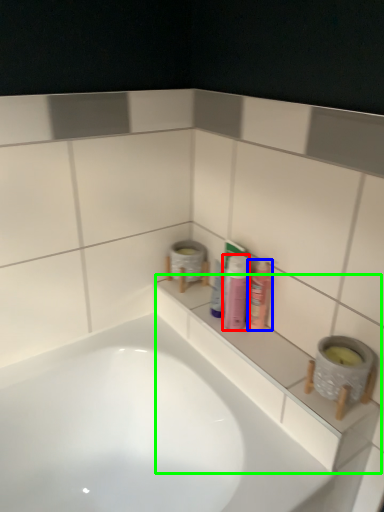
Question: Which object is the farthest from toiletry (highlighted by a red box)? Choose among these: mouthwash (highlighted by a blue box) or ledge (highlighted by a green box).

Choices:
 (A) mouthwash
 (B) ledge

Answer: (B)